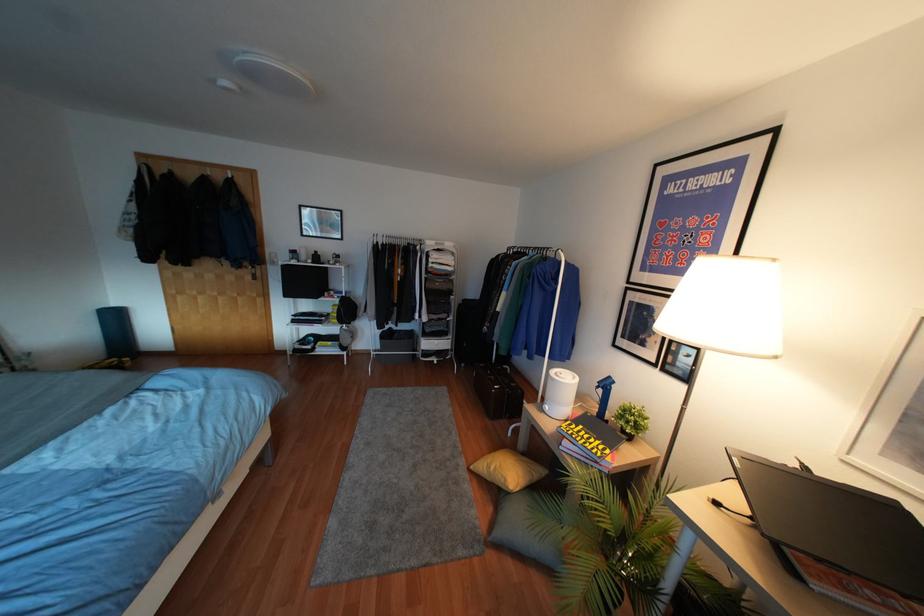
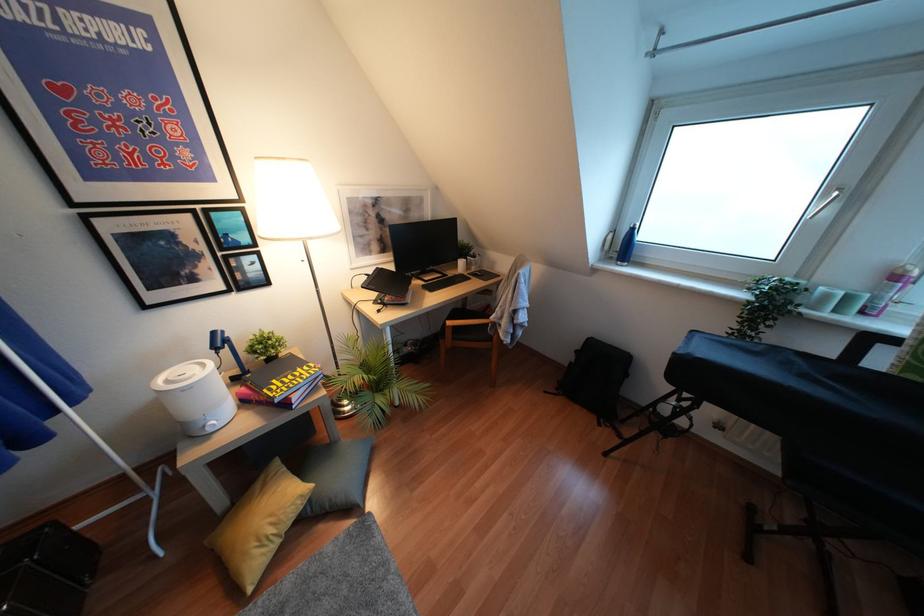
Where in the second image is the point corresponding to (x=492, y=468) from the first image?

(271, 530)